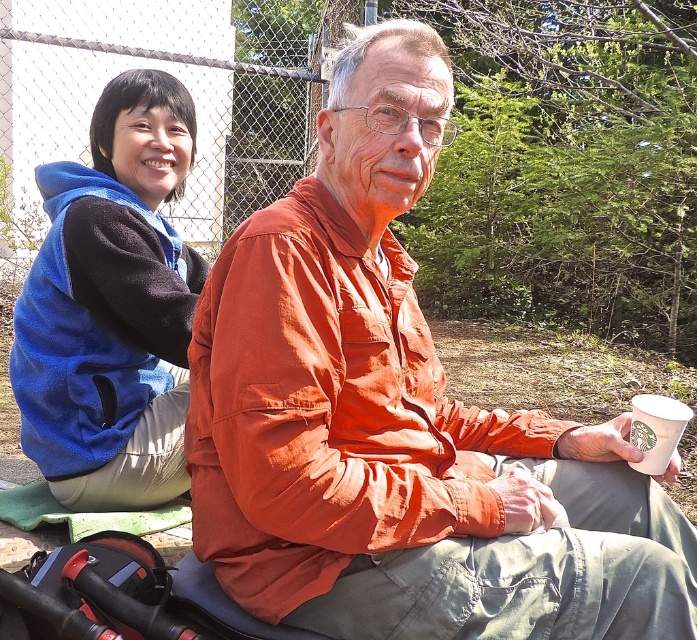
Question: Estimate the real-world distances between objects in this image. Which object is farther from the orange cotton shirt at center?

Choices:
 (A) blue fleece vest at upper left
 (B) white paper cup at lower right

Answer: (A)

Question: Is orange cotton shirt at center to the left of blue fleece vest at upper left from the viewer's perspective?

Choices:
 (A) yes
 (B) no

Answer: (B)

Question: Which point appears closest to the camera in this image?

Choices:
 (A) (358, 323)
 (B) (659, 468)

Answer: (A)

Question: Can you confirm if blue fleece vest at upper left is positioned above white paper cup at lower right?

Choices:
 (A) no
 (B) yes

Answer: (B)

Question: Considering the real-world distances, which object is closest to the orange cotton shirt at center?

Choices:
 (A) white paper cup at lower right
 (B) blue fleece vest at upper left

Answer: (A)

Question: Observing the image, what is the correct spatial positioning of blue fleece vest at upper left in reference to white paper cup at lower right?

Choices:
 (A) above
 (B) below

Answer: (A)